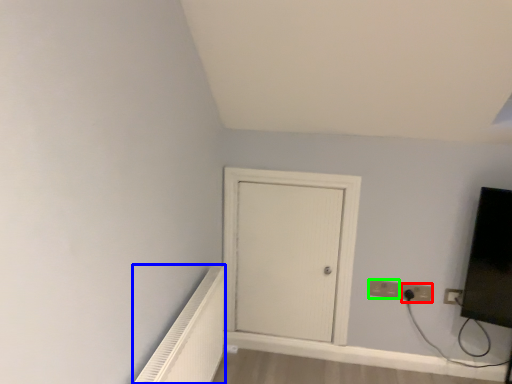
Question: Which object is the closest to the electric outlet (highlighted by a red box)? Choose among these: radiator (highlighted by a blue box) or electric outlet (highlighted by a green box).

Choices:
 (A) radiator
 (B) electric outlet

Answer: (B)